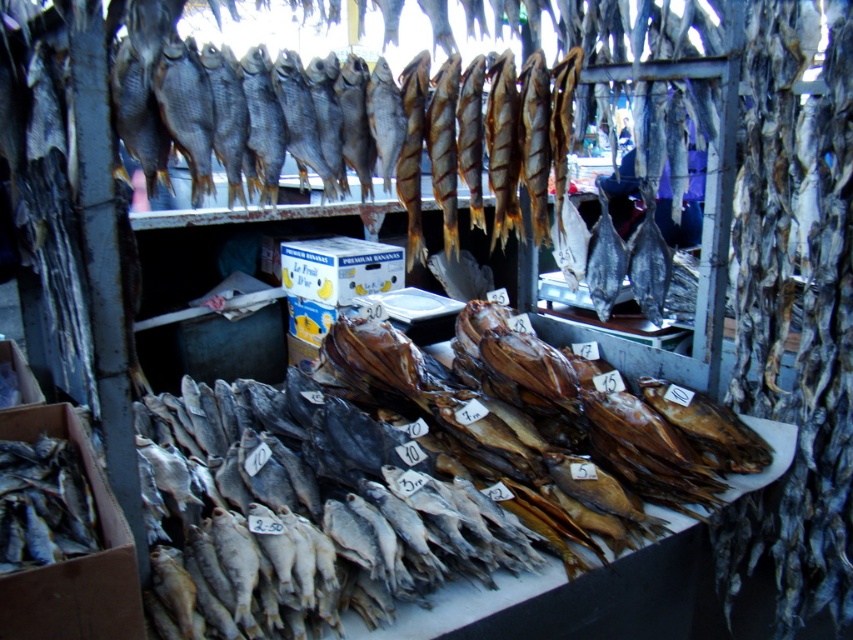
Does dark brown smoked fish at center have a larger size compared to shiny silver fish at center?

Yes, dark brown smoked fish at center is bigger than shiny silver fish at center.

Is dark brown smoked fish at center thinner than shiny silver fish at center?

In fact, dark brown smoked fish at center might be wider than shiny silver fish at center.

At what (x,y) coordinates should I click in order to perform the action: click on dark brown smoked fish at center. Please return your answer as a coordinate pair (x, y). This screenshot has width=853, height=640. Looking at the image, I should click on (412, 476).